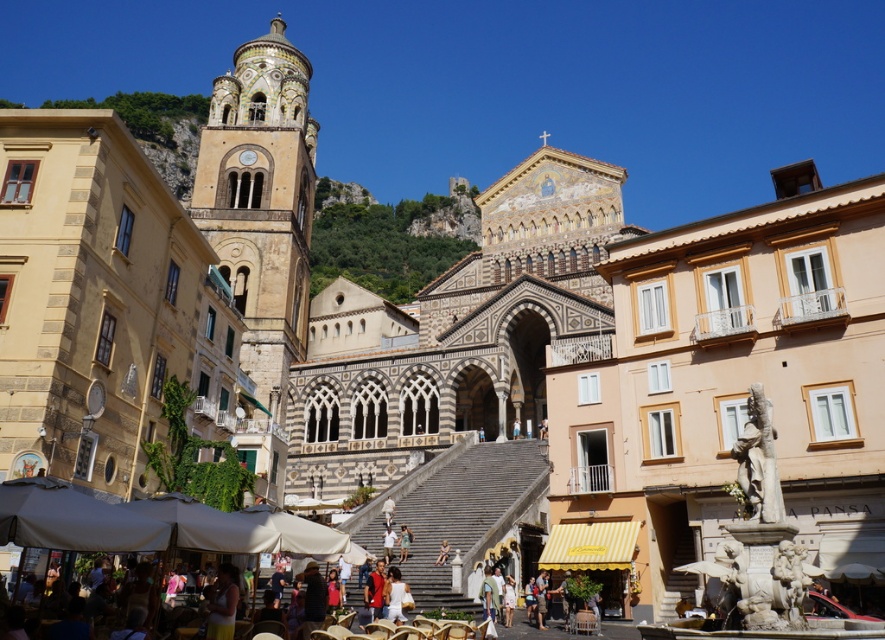
Question: Which of these objects is positioned closest to the white cotton shirt at center?

Choices:
 (A) light blue fabric dress at center
 (B) multicolored mosaic church at center

Answer: (A)

Question: Which is farther from the white cotton shirt at center?

Choices:
 (A) matte white statue at center
 (B) light blue fabric dress at center

Answer: (B)

Question: Is golden mosaic bell tower at center-left thinner than light blue fabric dress at center?

Choices:
 (A) yes
 (B) no

Answer: (B)

Question: Is golden mosaic bell tower at center-left below white cotton shirt at center?

Choices:
 (A) no
 (B) yes

Answer: (A)

Question: Which is farther from the matte white statue at center?

Choices:
 (A) light blue fabric dress at center
 (B) golden mosaic bell tower at center-left
 (C) multicolored mosaic church at center
 (D) white cotton shirt at center

Answer: (B)

Question: Can you confirm if gray stone stairs at center is positioned to the right of white cotton shirt at center?

Choices:
 (A) yes
 (B) no

Answer: (A)